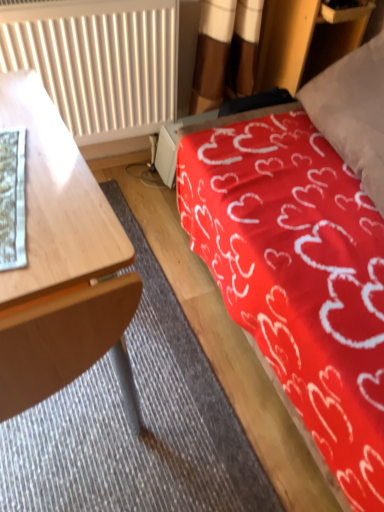
Where is `wooden desk at left`? wooden desk at left is located at coordinates (61, 265).

What do you see at coordinates (306, 254) in the screenshot? I see `red fabric bed at upper right` at bounding box center [306, 254].

What is the approximate width of red fabric bed at upper right?

red fabric bed at upper right is 90.61 centimeters in width.

In order to face white paper at left, should I rotate leftwards or rightwards?

To face it directly, rotate left by 34.058 degrees.

The image size is (384, 512). Find the location of `wooden desk at left`. wooden desk at left is located at coordinates (61, 265).

Does white paper at left have a lesser width compared to white textured radiator at upper left?

No.

Is the surface of white paper at left in direct contact with white textured radiator at upper left?

No, white paper at left is not touching white textured radiator at upper left.

From a real-world perspective, is white paper at left physically above white textured radiator at upper left?

Correct, in the physical world, white paper at left is higher than white textured radiator at upper left.

Is white paper at left aimed at white textured radiator at upper left?

No.

Considering the relative positions of red fabric bed at upper right and white paper at left in the image provided, is red fabric bed at upper right to the left of white paper at left from the viewer's perspective?

No.

Is red fabric bed at upper right positioned far away from white paper at left?

No, there isn't a large distance between red fabric bed at upper right and white paper at left.

Is red fabric bed at upper right wider than white paper at left?

Yes, red fabric bed at upper right is wider than white paper at left.

Who is smaller, red fabric bed at upper right or white paper at left?

Smaller between the two is white paper at left.

Is wooden desk at left surrounded by white paper at left?

Definitely not — wooden desk at left is not inside white paper at left.

Consider the image. Can you confirm if white paper at left is positioned to the left of wooden desk at left?

Yes.

From a real-world perspective, is white paper at left positioned over wooden desk at left based on gravity?

Yes, from a real-world perspective, white paper at left is on top of wooden desk at left.

From the picture: Is wooden desk at left inside or outside of white textured radiator at upper left?

wooden desk at left is spatially situated outside white textured radiator at upper left.

From a real-world perspective, is wooden desk at left physically located above or below white textured radiator at upper left?

In terms of real-world spatial position, wooden desk at left is below white textured radiator at upper left.

Is the surface of wooden desk at left in direct contact with white textured radiator at upper left?

They are not placed beside each other.

Considering the sizes of objects wooden desk at left and white textured radiator at upper left in the image provided, who is bigger, wooden desk at left or white textured radiator at upper left?

With larger size is wooden desk at left.

Between white textured radiator at upper left and red fabric bed at upper right, which one is positioned behind?

white textured radiator at upper left is behind.

Between white textured radiator at upper left and red fabric bed at upper right, which one has more height?

red fabric bed at upper right is taller.

Does white textured radiator at upper left appear on the right side of red fabric bed at upper right?

Incorrect, white textured radiator at upper left is not on the right side of red fabric bed at upper right.

Considering the sizes of white textured radiator at upper left and red fabric bed at upper right in the image, is white textured radiator at upper left wider or thinner than red fabric bed at upper right?

In the image, white textured radiator at upper left appears to be more narrow than red fabric bed at upper right.

From a real-world perspective, does white textured radiator at upper left sit lower than wooden desk at left?

Incorrect, from a real-world perspective, white textured radiator at upper left is higher than wooden desk at left.

Which is correct: white textured radiator at upper left is inside wooden desk at left, or outside of it?

white textured radiator at upper left is located beyond the bounds of wooden desk at left.

Is white textured radiator at upper left positioned far away from wooden desk at left?

No, white textured radiator at upper left is not far away from wooden desk at left.

Can you confirm if white textured radiator at upper left is taller than wooden desk at left?

No, white textured radiator at upper left is not taller than wooden desk at left.

From a real-world perspective, is white textured radiator at upper left positioned over white paper at left based on gravity?

No, from a real-world perspective, white textured radiator at upper left is not on top of white paper at left.

Can you confirm if white textured radiator at upper left is positioned to the right of white paper at left?

Yes.

Does white textured radiator at upper left have a lesser width compared to white paper at left?

Yes.

You are a GUI agent. You are given a task and a screenshot of the screen. Output one action in this format:
    pyautogui.click(x=<x>, y=<y>)
    Task: Click on the sheet that appears below the white textured radiator at upper left (from the image's perspective)
    
    Given the screenshot: What is the action you would take?
    pyautogui.click(x=12, y=199)

You are a GUI agent. You are given a task and a screenshot of the screen. Output one action in this format:
    pyautogui.click(x=<x>, y=<y>)
    Task: Click on the bed located above the white paper at left (from the image's perspective)
    This screenshot has height=512, width=384.
    Given the screenshot: What is the action you would take?
    pyautogui.click(x=306, y=254)

Estimate the real-world distances between objects in this image. Which object is closer to wooden desk at left, white textured radiator at upper left or white paper at left?

Among the two, white paper at left is located nearer to wooden desk at left.

Estimate the real-world distances between objects in this image. Which object is further from white paper at left, wooden desk at left or white textured radiator at upper left?

white textured radiator at upper left is further to white paper at left.

From the picture: Looking at the image, which one is located closer to wooden desk at left, red fabric bed at upper right or white paper at left?

Among the two, white paper at left is located nearer to wooden desk at left.

Which object lies nearer to the anchor point white paper at left, wooden desk at left or red fabric bed at upper right?

wooden desk at left.

From the image, which object appears to be nearer to red fabric bed at upper right, white paper at left or wooden desk at left?

wooden desk at left.

Based on their spatial positions, is white textured radiator at upper left or wooden desk at left further from white paper at left?

white textured radiator at upper left lies further to white paper at left than the other object.

Looking at the image, which one is located closer to red fabric bed at upper right, white textured radiator at upper left or white paper at left?

The object closer to red fabric bed at upper right is white textured radiator at upper left.

Looking at the image, which one is located closer to white textured radiator at upper left, wooden desk at left or white paper at left?

wooden desk at left lies closer to white textured radiator at upper left than the other object.

The width and height of the screenshot is (384, 512). I want to click on radiator between wooden desk at left and red fabric bed at upper right, so click(97, 61).

Identify the location of radiator between white paper at left and red fabric bed at upper right in the horizontal direction. The width and height of the screenshot is (384, 512). (97, 61).

Locate an element on the screen. This screenshot has height=512, width=384. desk between white paper at left and red fabric bed at upper right is located at coordinates (61, 265).

Where is `sheet between wooden desk at left and white textured radiator at upper left in the front-back direction`? This screenshot has height=512, width=384. sheet between wooden desk at left and white textured radiator at upper left in the front-back direction is located at coordinates tap(12, 199).